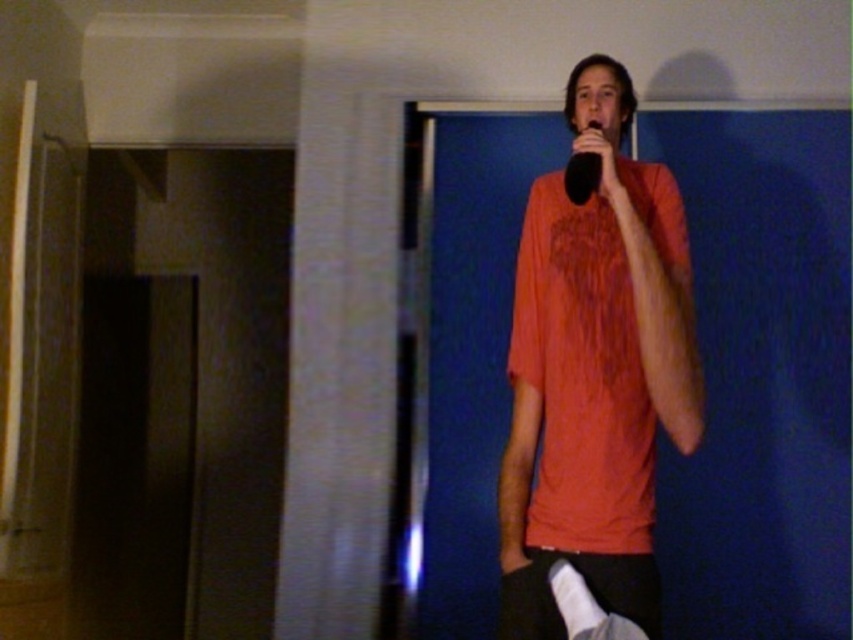
Question: Among these objects, which one is farthest from the camera?

Choices:
 (A) orange cotton shirt at center
 (B) black matte microphone at upper center

Answer: (B)

Question: Is orange cotton shirt at center thinner than black matte microphone at upper center?

Choices:
 (A) yes
 (B) no

Answer: (B)

Question: Which point is closer to the camera taking this photo?

Choices:
 (A) (498, 637)
 (B) (579, 157)

Answer: (B)

Question: Is orange cotton shirt at center thinner than black matte microphone at upper center?

Choices:
 (A) no
 (B) yes

Answer: (A)

Question: Can you confirm if orange cotton shirt at center is positioned to the left of black matte microphone at upper center?

Choices:
 (A) yes
 (B) no

Answer: (B)

Question: Among these points, which one is farthest from the camera?

Choices:
 (A) (577, 154)
 (B) (648, 584)

Answer: (A)